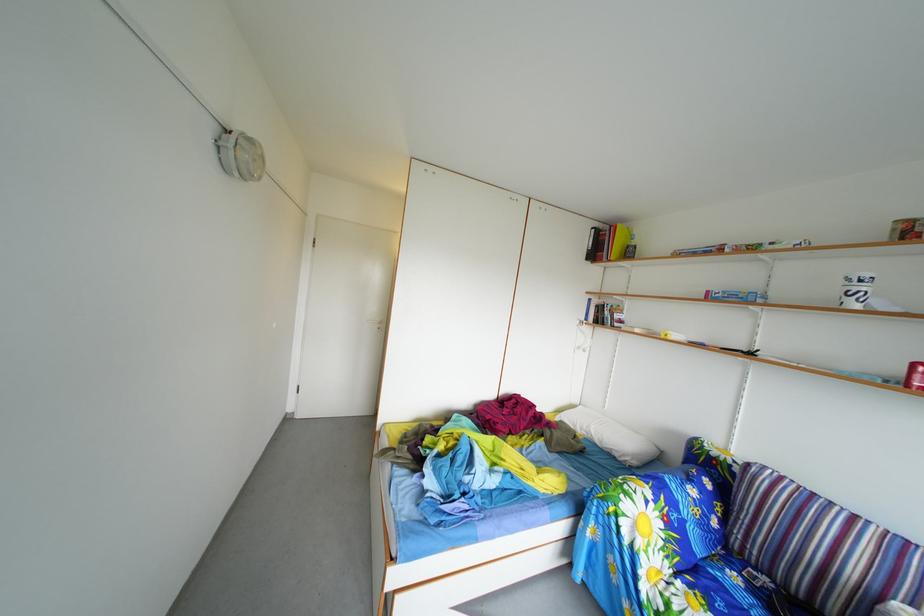
Where would you turn the white door handle? Please return your answer as a coordinate pair (x, y).

(374, 323)